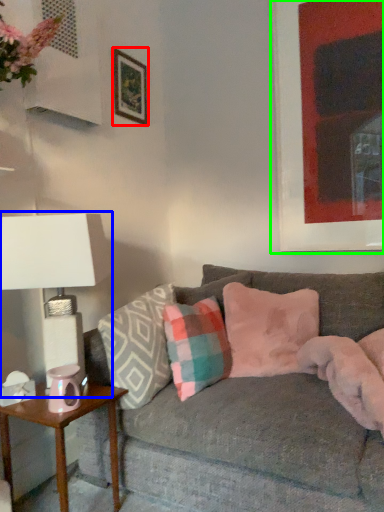
Question: Based on their relative distances, which object is nearer to picture frame (highlighted by a red box)? Choose from table lamp (highlighted by a blue box) and picture frame (highlighted by a green box).

Choices:
 (A) table lamp
 (B) picture frame

Answer: (B)